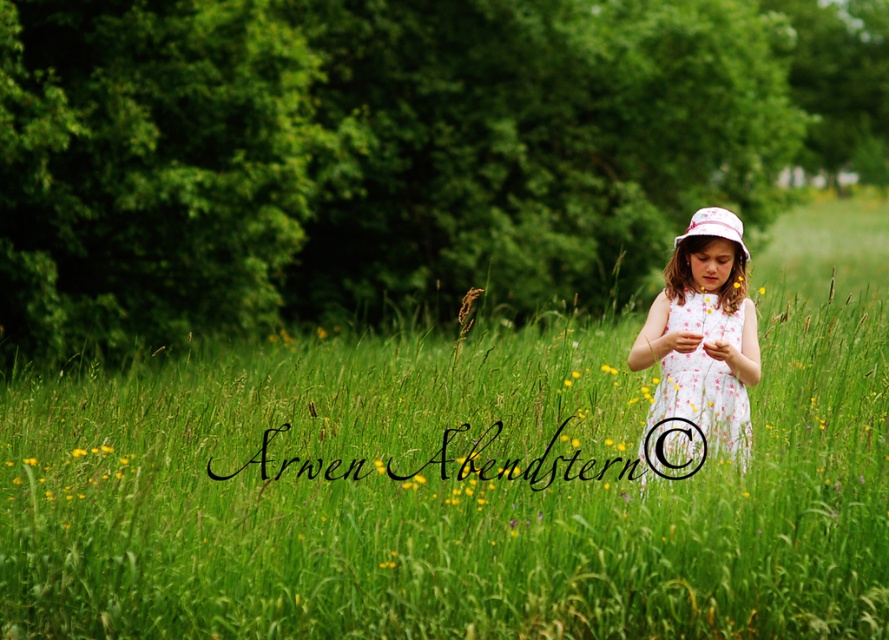
The girl is holding something in her hands. If you were to draw an imaginary straight line from the bottom of the white dotted dress at center to the bottom of the pink fabric bucket hat at center, would the line pass through the object she is holding?

The white dotted dress at center is to the left of the pink fabric bucket hat at center, so the line drawn between them would pass through the object she is holding.

You are a photographer trying to capture the girl in the image. You want to ensure both the white dotted dress at center and the pink fabric bucket hat at center are clearly visible in your photo. Which object should you focus on first to ensure depth of field captures both?

You should focus on the white dotted dress at center first because it is closer to the viewer than the pink fabric bucket hat at center. By focusing on the closer object, the depth of field will extend backward, potentially keeping both in focus.

You are a photographer trying to capture the pink fabric bucket hat at center and the yellow soft grass at center in a single shot. Since both are at the center, which object will appear larger in the photo?

The pink fabric bucket hat at center is closer to the viewer than the yellow soft grass at center, so it will appear larger in the photo.